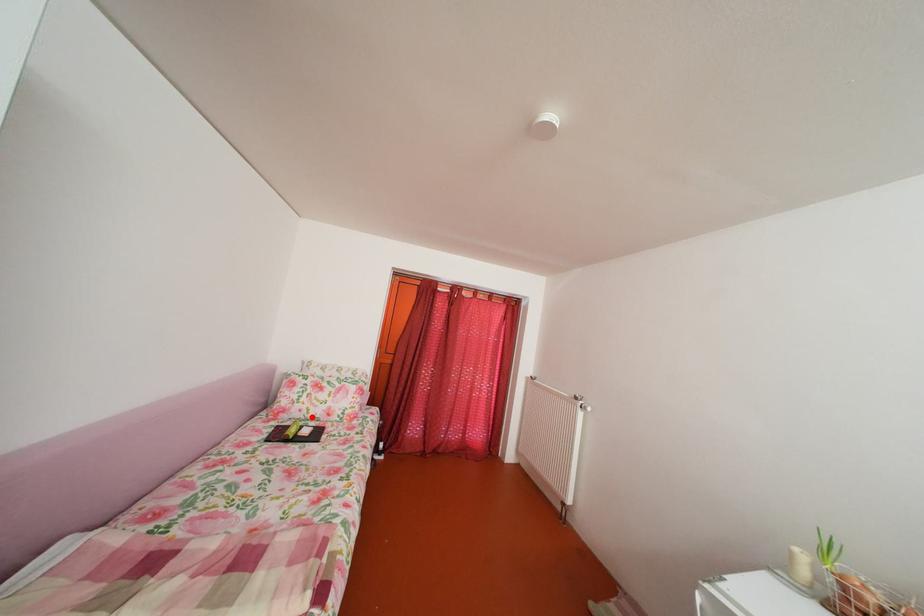
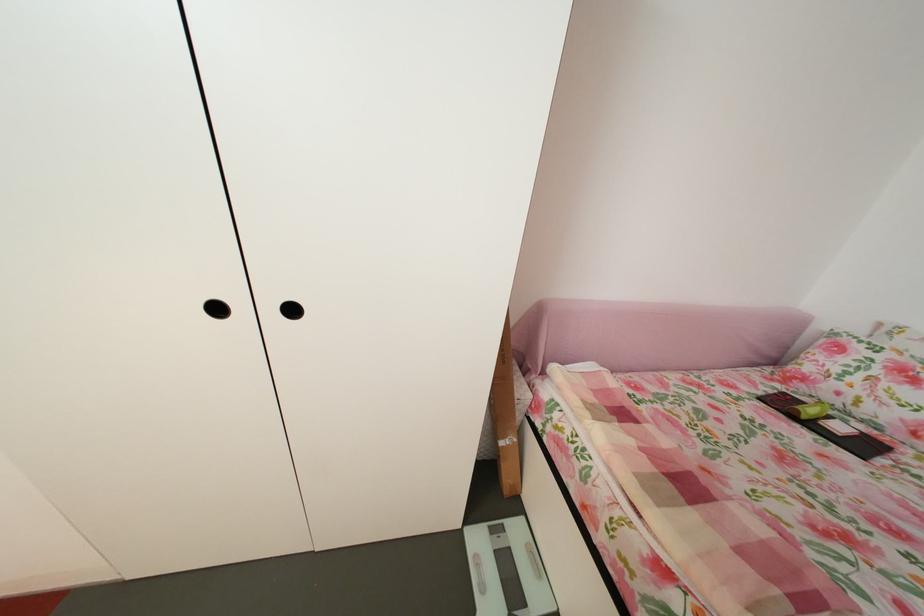
Find the pixel in the second image that matches the highlighted location in the first image.

(849, 400)